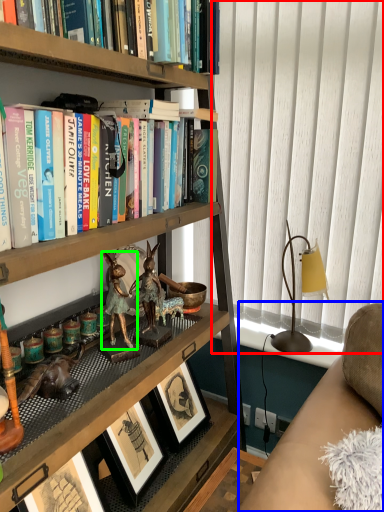
Question: Which is farther away from curtain (highlighted by a red box)? studio couch (highlighted by a blue box) or animal (highlighted by a green box)?

Choices:
 (A) studio couch
 (B) animal

Answer: (B)